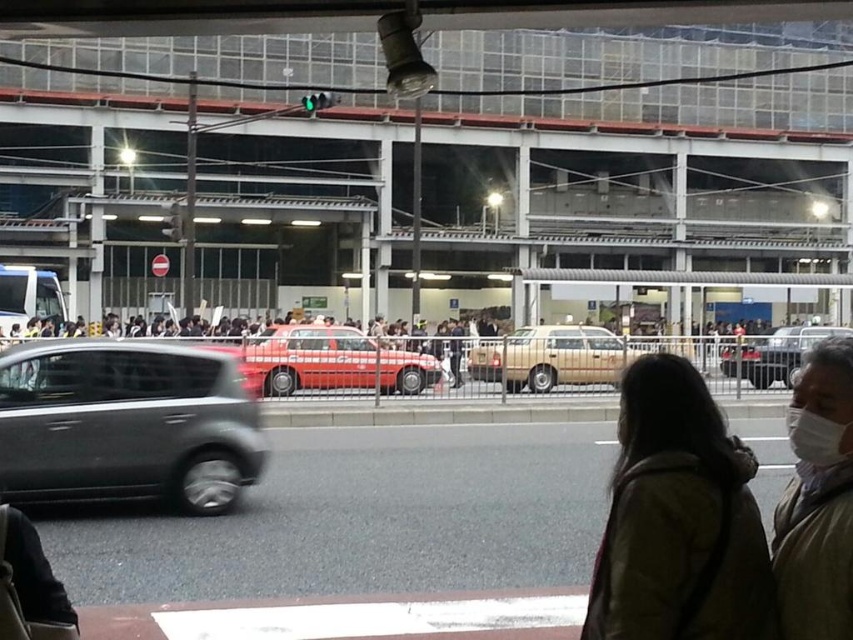
Between satin black hatchback at left and shiny black sedan at center, which one appears on the left side from the viewer's perspective?

satin black hatchback at left

What do you see at coordinates (128, 422) in the screenshot? The width and height of the screenshot is (853, 640). I see `satin black hatchback at left` at bounding box center [128, 422].

Where is `satin black hatchback at left`? satin black hatchback at left is located at coordinates (128, 422).

Can you confirm if satin black hatchback at left is smaller than shiny red car at center?

Incorrect, satin black hatchback at left is not smaller in size than shiny red car at center.

Does satin black hatchback at left lie behind shiny red car at center?

No, it is not.

Between point (106, 484) and point (335, 330), which one is positioned in front?

Point (106, 484) is more forward.

You are a GUI agent. You are given a task and a screenshot of the screen. Output one action in this format:
    pyautogui.click(x=<x>, y=<y>)
    Task: Click on the satin black hatchback at left
    
    Given the screenshot: What is the action you would take?
    pyautogui.click(x=128, y=422)

Does shiny red car at center lie behind shiny black sedan at center?

That is True.

Describe the element at coordinates (335, 362) in the screenshot. I see `shiny red car at center` at that location.

At what (x,y) coordinates should I click in order to perform the action: click on shiny red car at center. Please return your answer as a coordinate pair (x, y). This screenshot has height=640, width=853. Looking at the image, I should click on (335, 362).